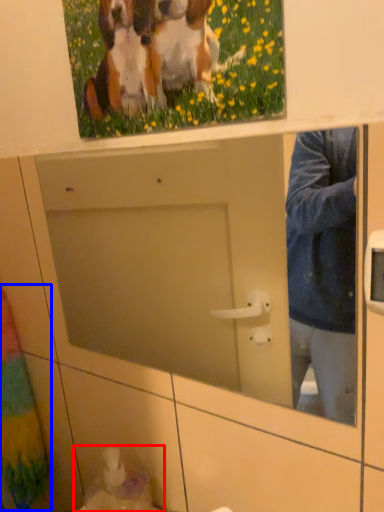
Question: Which point is closer to the camera, sink (highlighted by a red box) or curtain (highlighted by a blue box)?

Choices:
 (A) sink
 (B) curtain

Answer: (A)